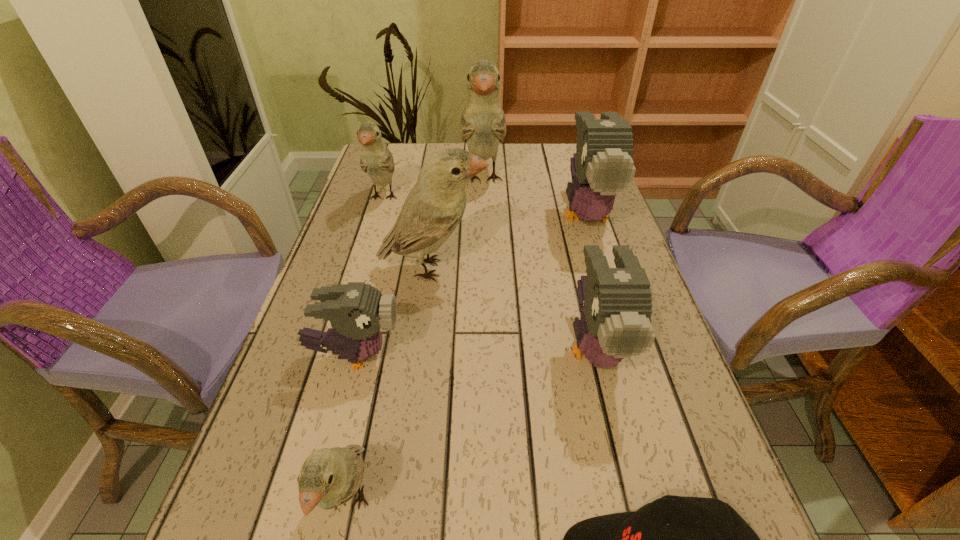
This screenshot has width=960, height=540. What are the coordinates of `free point between the tallest object and the second biggest white bird` in the screenshot? It's located at (458, 224).

Identify the location of free spot between the fourth farthest object and the second biggest gray bird. (514, 308).

Locate an element on the screen. This screenshot has height=540, width=960. object that stands as the fifth closest to the tallest object is located at coordinates (356, 311).

The height and width of the screenshot is (540, 960). In order to click on object that can be found as the sixth closest to the biggest gray bird in this screenshot , I will do `click(706, 539)`.

Identify which bird is the nearest to the nearest bird. Please provide its 2D coordinates. Your answer should be formatted as a tuple, i.e. [(x, y)], where the tuple contains the x and y coordinates of a point satisfying the conditions above.

[(356, 311)]

Identify which bird is the closest to the shortest object. Please provide its 2D coordinates. Your answer should be formatted as a tuple, i.e. [(x, y)], where the tuple contains the x and y coordinates of a point satisfying the conditions above.

[(615, 323)]

Identify the location of white bird that is the fourth closest to the baseball cap. (376, 160).

Choose which white bird is the second nearest neighbor to the third biggest white bird. Please provide its 2D coordinates. Your answer should be formatted as a tuple, i.e. [(x, y)], where the tuple contains the x and y coordinates of a point satisfying the conditions above.

[(483, 125)]

Identify which gray bird is the nearest to the second nearest white bird. Please provide its 2D coordinates. Your answer should be formatted as a tuple, i.e. [(x, y)], where the tuple contains the x and y coordinates of a point satisfying the conditions above.

[(356, 311)]

Select which gray bird appears as the third closest to the shortest object. Please provide its 2D coordinates. Your answer should be formatted as a tuple, i.e. [(x, y)], where the tuple contains the x and y coordinates of a point satisfying the conditions above.

[(602, 165)]